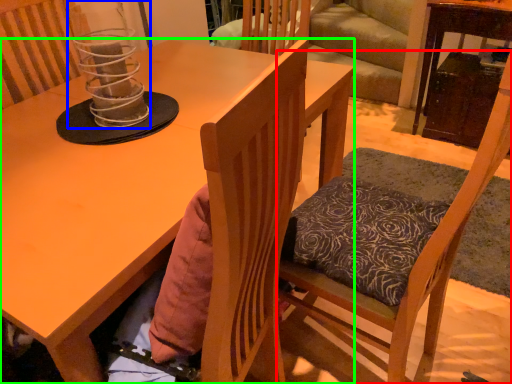
Question: Considering the real-world distances, which object is closest to chair (highlighted by a red box)? candle holder (highlighted by a blue box) or desk (highlighted by a green box).

Choices:
 (A) candle holder
 (B) desk

Answer: (B)